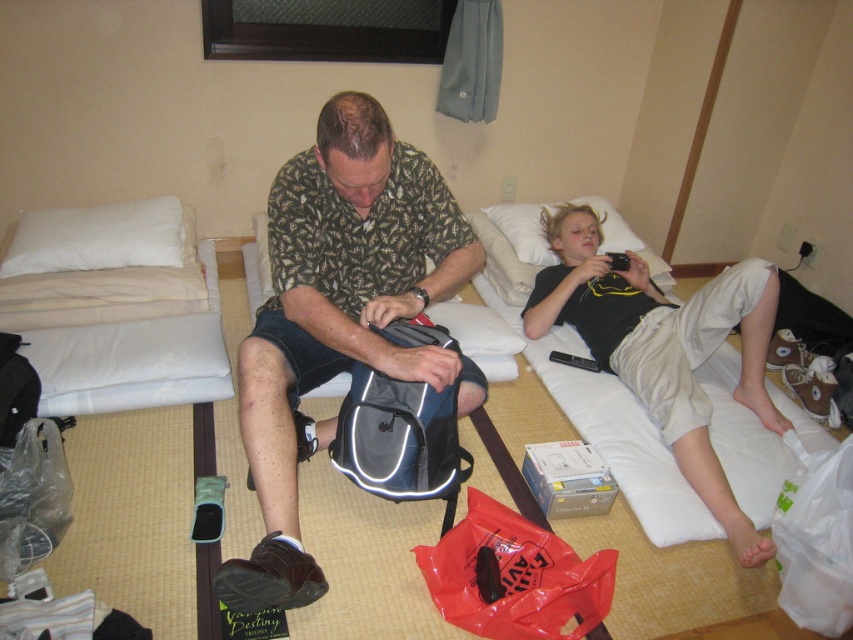
You are standing in the hotel room and want to place a small vase between the two points labeled as point (363, 346) and point (61, 465). Which point should the vase be closer to if you want it to be nearer to the viewer?

The vase should be placed closer to point (363, 346) because it is closer to the viewer than point (61, 465).

You are a traveler who just arrived at the hotel room. You have a rubberized red bag at lower center and a white soft pillow at upper left. You want to place both items on the same shelf in your luggage cart. The shelf has a width limit. Which item might not fit if the shelf can only accommodate the narrower of the two?

The rubberized red bag at lower center might not fit on the shelf if the shelf can only accommodate the narrower item, since its width is less than the white soft pillow at upper left.